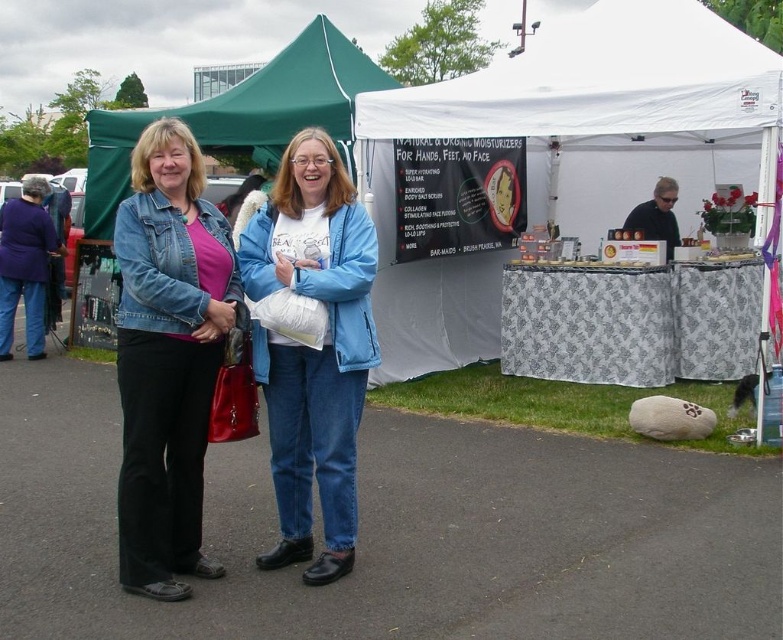
You are standing at the point with coordinates point (659, 234) and want to walk to the point with coordinates point (4, 221). Based on the scene description, is the destination point visible from your current position?

Yes, the destination point (4, 221) is behind point (659, 234), so it should be visible from your current position unless there are obstacles blocking the view.